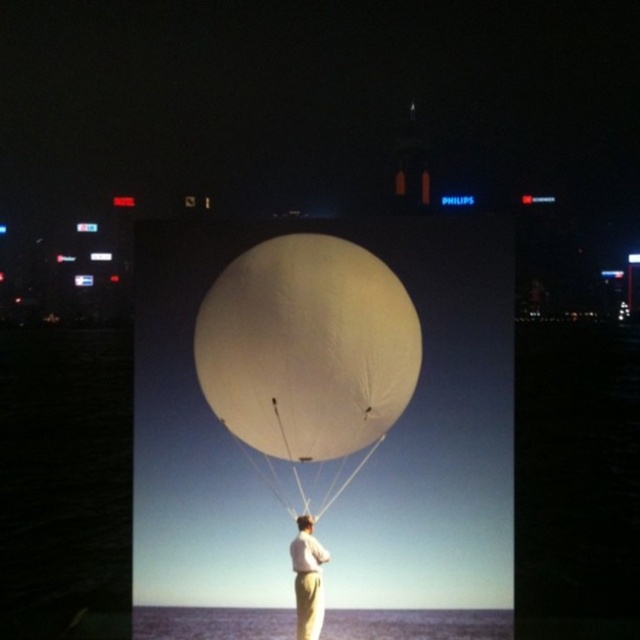
Consider the image. You are a photographer standing in front of the white matte balloon at center and the transparent plastic water at lower center. You want to capture a photo where both objects are visible but the balloon appears to the right side of the water. Is this possible based on their current positions?

The white matte balloon at center is to the left of transparent plastic water at lower center, so to have the balloon appear on the right side of the water in the photo, you would need to adjust your position or the objects since their current arrangement has the balloon on the left.